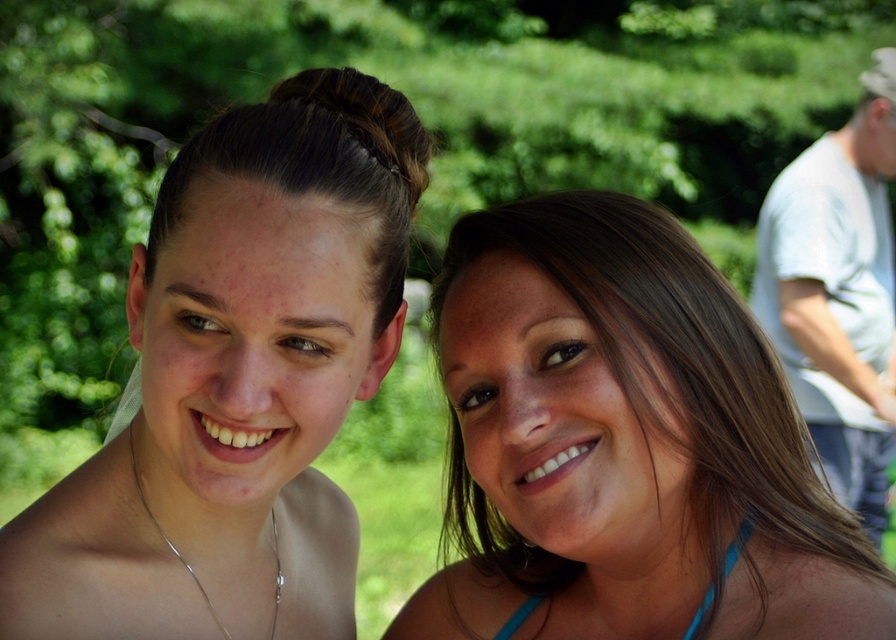
Looking at this image, you are a photographer adjusting your camera settings to capture a portrait of two people in a park. You notice the matte skin at center and the white cotton shirt at upper right in your frame. Which object should you focus on if you want to highlight the smaller one?

The matte skin at center is smaller than the white cotton shirt at upper right, so you should focus on the matte skin at center to highlight the smaller one.

You are a photographer using a camera with a focal length of 50mm. You want to take a portrait of the person with matte skin at center. If the recommended distance for this camera setup is between 50 to 100 inches, is the current distance suitable?

The matte skin at center and camera are 35.32 inches apart from each other. Since the recommended distance is between 50 to 100 inches, the current distance of 35.32 inches is too close. Move back to ensure proper framing and focus.